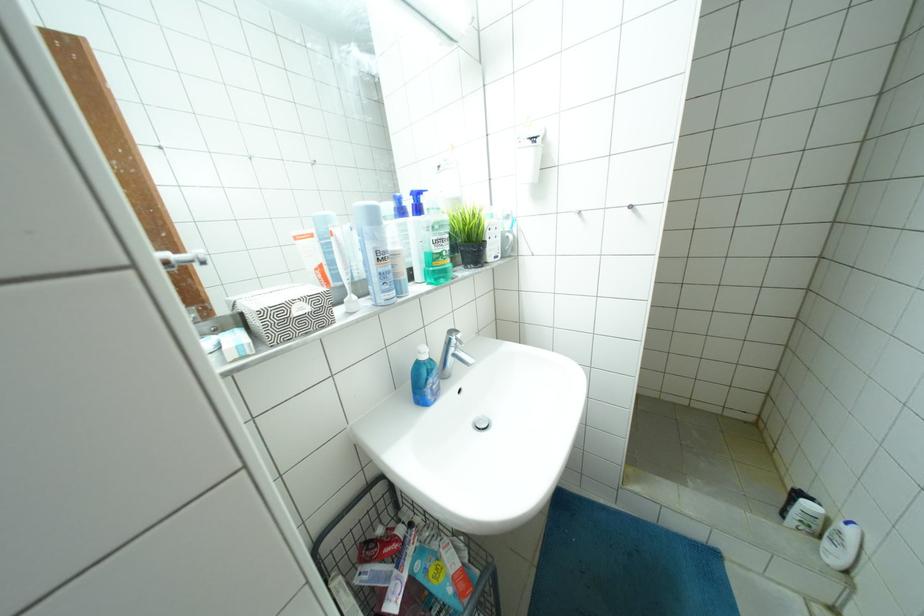
Find where to push the blue bottle pump. Please return your answer as a coordinate pair (x, y).

(421, 352)